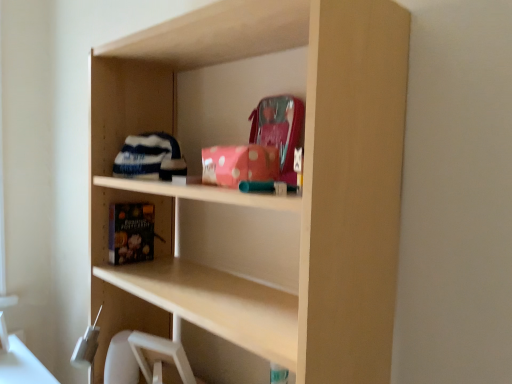
Question: Should I look upward or downward to see pink polka dot fabric at upper center, acting as the 2th book starting from the back?

Choices:
 (A) down
 (B) up

Answer: (B)

Question: Is pink polka dot fabric at upper center, the first book when ordered from right to left, taller than black matte book at lower left, which is counted as the second book, starting from the top?

Choices:
 (A) no
 (B) yes

Answer: (A)

Question: Could you tell me if pink polka dot fabric at upper center, placed as the 2th book when sorted from bottom to top, is facing black matte book at lower left, the 2th book viewed from the front?

Choices:
 (A) yes
 (B) no

Answer: (B)

Question: From a real-world perspective, does pink polka dot fabric at upper center, the first book when ordered from right to left, sit lower than black matte book at lower left, marked as the 2th book in a right-to-left arrangement?

Choices:
 (A) no
 (B) yes

Answer: (A)

Question: Considering the relative sizes of pink polka dot fabric at upper center, acting as the 2th book starting from the back, and black matte book at lower left, marked as the 2th book in a right-to-left arrangement, in the image provided, is pink polka dot fabric at upper center, acting as the 2th book starting from the back, shorter than black matte book at lower left, marked as the 2th book in a right-to-left arrangement,?

Choices:
 (A) yes
 (B) no

Answer: (A)

Question: Considering the relative sizes of pink polka dot fabric at upper center, the first book when ordered from right to left, and black matte book at lower left, the 2th book viewed from the front, in the image provided, is pink polka dot fabric at upper center, the first book when ordered from right to left, smaller than black matte book at lower left, the 2th book viewed from the front,?

Choices:
 (A) no
 (B) yes

Answer: (A)

Question: Is pink polka dot fabric at upper center, the 1th book positioned from the top, positioned with its back to black matte book at lower left, the 2th book viewed from the front?

Choices:
 (A) no
 (B) yes

Answer: (A)

Question: Is black matte book at lower left, the 2th book viewed from the front, oriented away from pink polka dot fabric at upper center, the first book when ordered from right to left?

Choices:
 (A) yes
 (B) no

Answer: (B)

Question: Is black matte book at lower left, placed as the first book when sorted from bottom to top, oriented towards pink polka dot fabric at upper center, acting as the 2th book starting from the back?

Choices:
 (A) no
 (B) yes

Answer: (A)

Question: Is black matte book at lower left, placed as the first book when sorted from bottom to top, wider than pink polka dot fabric at upper center, acting as the 2th book starting from the back?

Choices:
 (A) no
 (B) yes

Answer: (B)

Question: Would you consider black matte book at lower left, marked as the 2th book in a right-to-left arrangement, to be distant from pink polka dot fabric at upper center, the first book when ordered from right to left?

Choices:
 (A) no
 (B) yes

Answer: (A)

Question: From a real-world perspective, is black matte book at lower left, placed as the first book when sorted from bottom to top, located beneath pink polka dot fabric at upper center, acting as the 2th book starting from the back?

Choices:
 (A) no
 (B) yes

Answer: (B)

Question: From the image's perspective, is black matte book at lower left, the 2th book viewed from the front, beneath pink polka dot fabric at upper center, arranged as the 1th book when viewed from the front?

Choices:
 (A) yes
 (B) no

Answer: (A)

Question: From their relative heights in the image, would you say black matte book at lower left, the 1th book in the back-to-front sequence, is taller or shorter than pink polka dot fabric at upper center, arranged as the 1th book when viewed from the front?

Choices:
 (A) short
 (B) tall

Answer: (B)